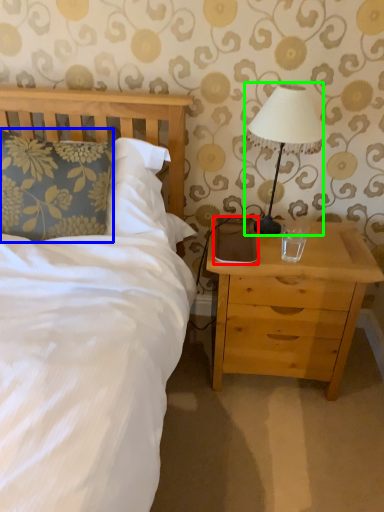
Question: Estimate the real-world distances between objects in this image. Which object is closer to pad (highlighted by a red box), pillow (highlighted by a blue box) or table lamp (highlighted by a green box)?

Choices:
 (A) pillow
 (B) table lamp

Answer: (B)